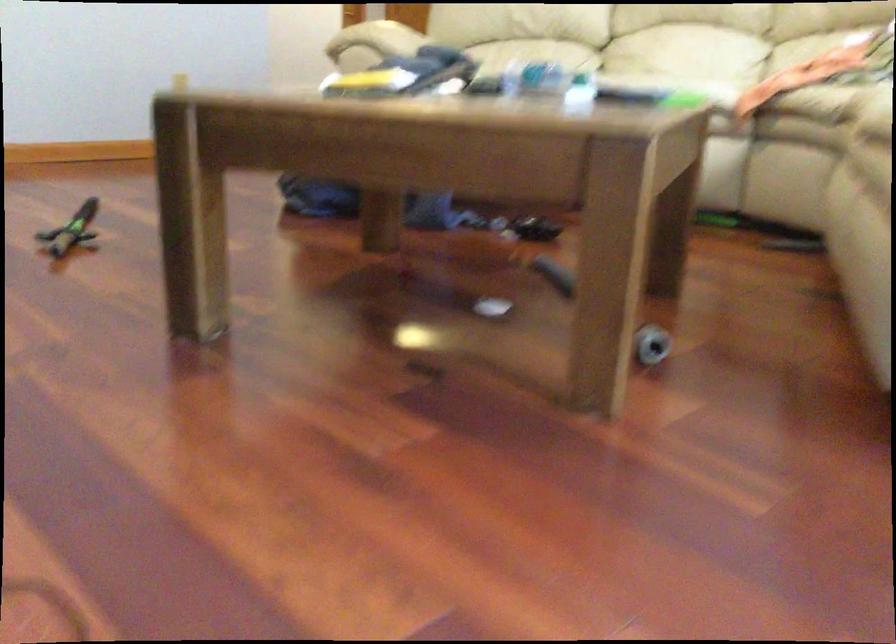
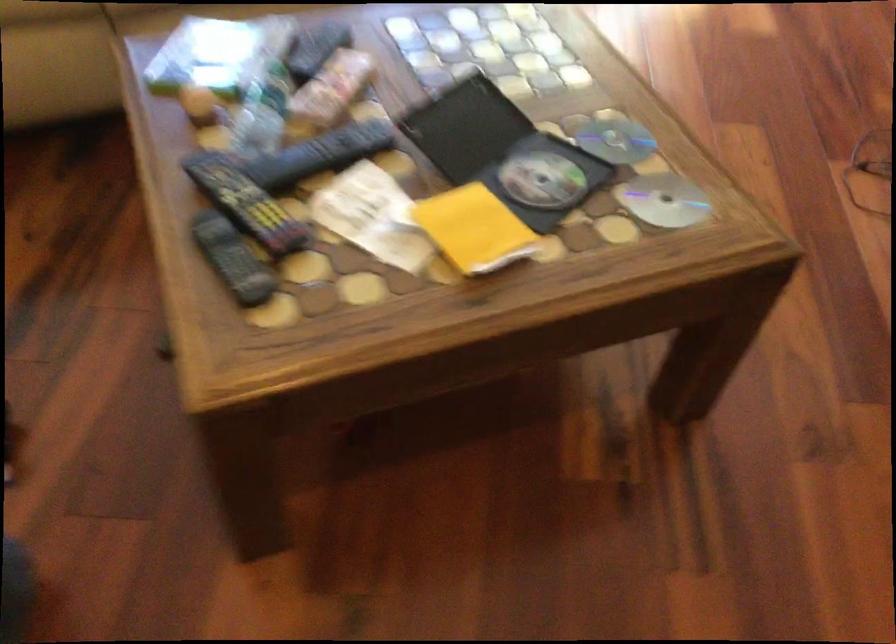
Question: I am providing you with two images of the same scene from different viewpoints. Please identify which objects are invisible in image2.

Choices:
 (A) black DVD case
 (B) silver disc
 (C) black remote control
 (D) none of these

Answer: (D)